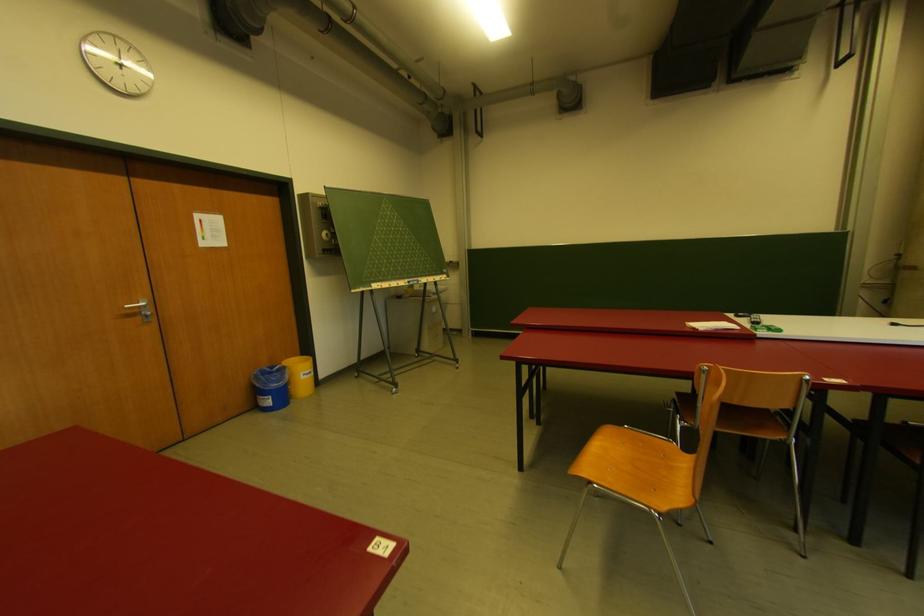
Where is `metal door handle`? This screenshot has height=616, width=924. metal door handle is located at coordinates (137, 304).